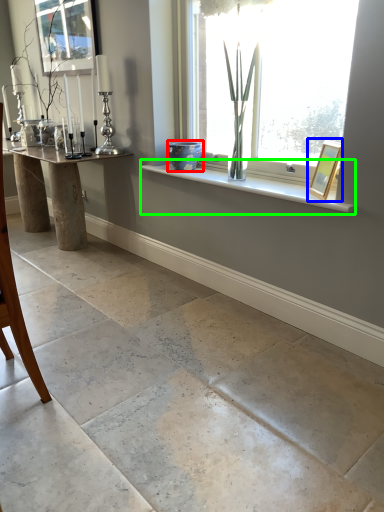
Question: Which object is positioned farthest from glass vase (highlighted by a red box)? Select from picture frame (highlighted by a blue box) and window sill (highlighted by a green box).

Choices:
 (A) picture frame
 (B) window sill

Answer: (A)